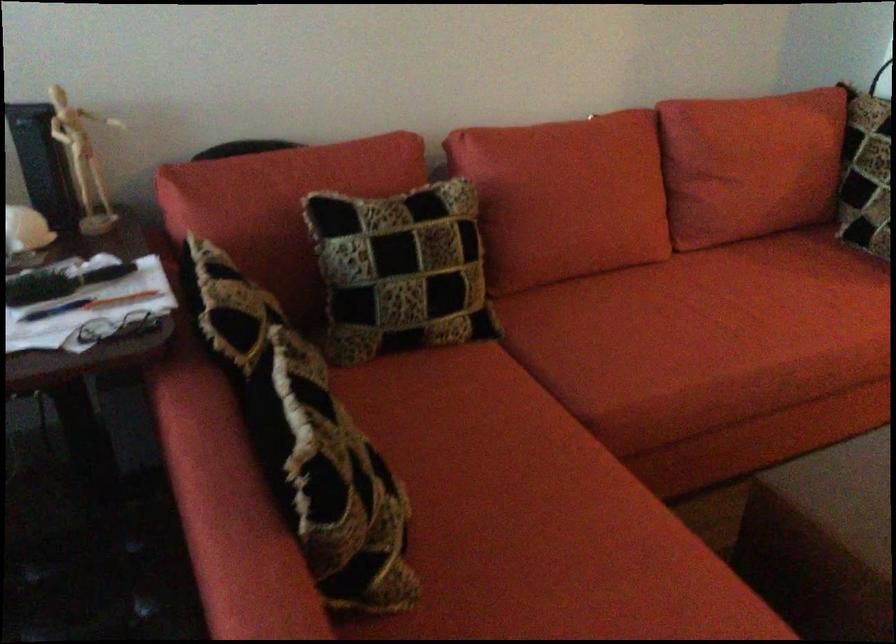
At what (x,y) coordinates should I click in order to perform the action: click on red sofa sitting surface. Please return your answer as a coordinate pair (x, y). The height and width of the screenshot is (644, 896). Looking at the image, I should click on (726, 323).